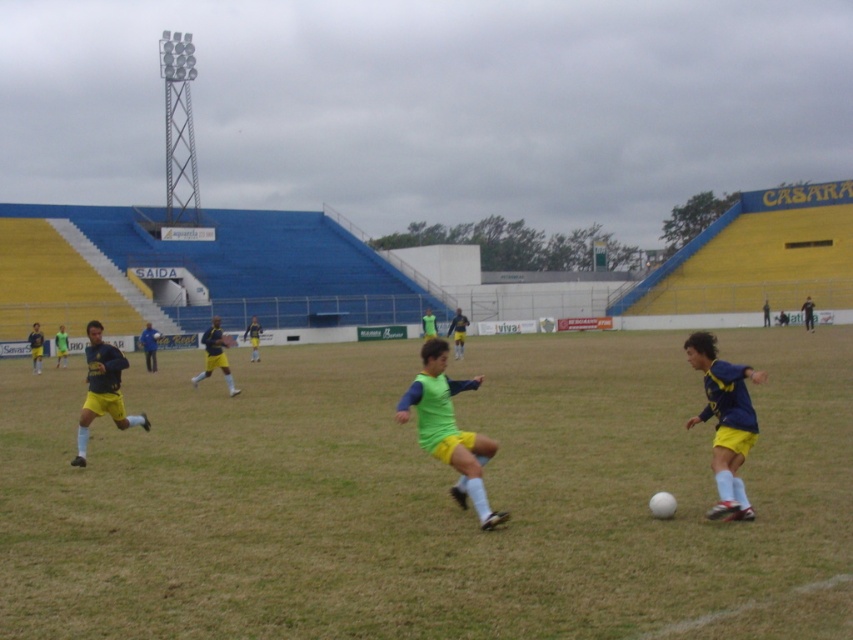
Question: Is green matte jersey at center further to camera compared to yellow jersey at left?

Choices:
 (A) no
 (B) yes

Answer: (A)

Question: Does blue jersey at center come behind yellow jersey at left?

Choices:
 (A) no
 (B) yes

Answer: (A)

Question: Which of the following is the farthest from the observer?

Choices:
 (A) blue jersey at center
 (B) green grass at center
 (C) green matte jersey at center
 (D) yellow jersey at center

Answer: (D)

Question: Among these points, which one is nearest to the camera?

Choices:
 (A) (238, 392)
 (B) (480, 436)

Answer: (B)

Question: Is green grass at center positioned in front of yellow jersey at left?

Choices:
 (A) no
 (B) yes

Answer: (B)

Question: Estimate the real-world distances between objects in this image. Which object is farther from the blue jersey at center?

Choices:
 (A) yellow jersey at left
 (B) green matte jersey at center

Answer: (A)